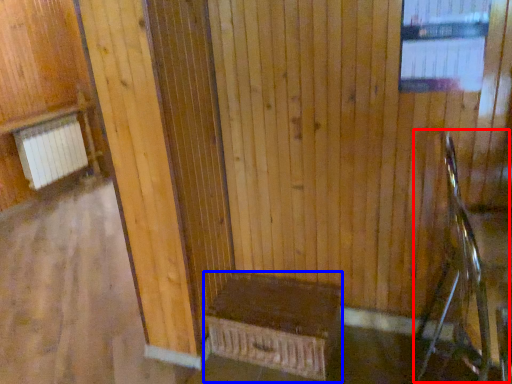
Question: Which of the following is the closest to the observer, rocking chair (highlighted by a red box) or furniture (highlighted by a blue box)?

Choices:
 (A) rocking chair
 (B) furniture

Answer: (A)